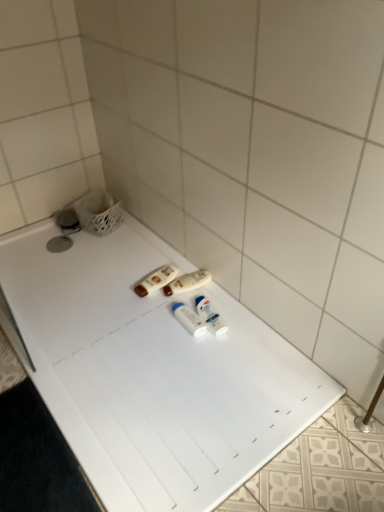
The height and width of the screenshot is (512, 384). In order to click on free space on the front side of brown plastic lotion at center, positioned as the 4th toiletry in right-to-left order in this screenshot , I will do `click(145, 315)`.